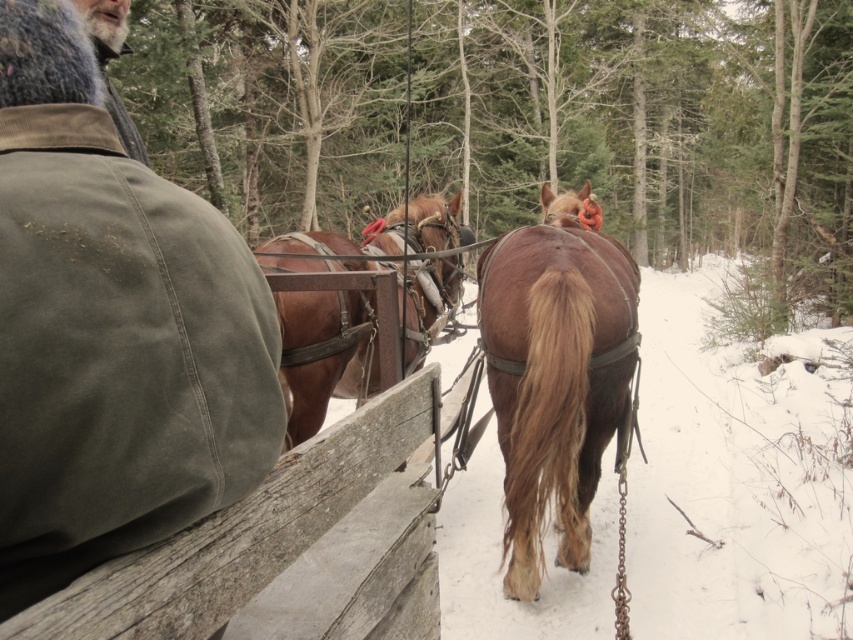
Who is more distant from viewer, (30, 218) or (579, 470)?

Point (579, 470)

Measure the distance from green canvas coach at upper left to brown leather horse at center.

A distance of 9.36 feet exists between green canvas coach at upper left and brown leather horse at center.

The width and height of the screenshot is (853, 640). Find the location of `green canvas coach at upper left`. green canvas coach at upper left is located at coordinates (112, 330).

Who is more forward, (49, 192) or (271, 259)?

Point (49, 192) is in front.

Does green canvas coach at upper left lie behind brown leather harness at center?

No, green canvas coach at upper left is closer to the viewer.

Is point (236, 269) closer to viewer compared to point (415, 250)?

Yes, point (236, 269) is closer to viewer.

Locate an element on the screen. The image size is (853, 640). green canvas coach at upper left is located at coordinates (112, 330).

Does brown leather horse at center appear over brown leather harness at center?

No, brown leather horse at center is not above brown leather harness at center.

Can you confirm if brown leather horse at center is positioned to the left of brown leather harness at center?

In fact, brown leather horse at center is to the right of brown leather harness at center.

Between point (599, 392) and point (444, 225), which one is positioned in front?

Point (599, 392) is in front.

Where is `brown leather horse at center`? Image resolution: width=853 pixels, height=640 pixels. brown leather horse at center is located at coordinates (555, 376).